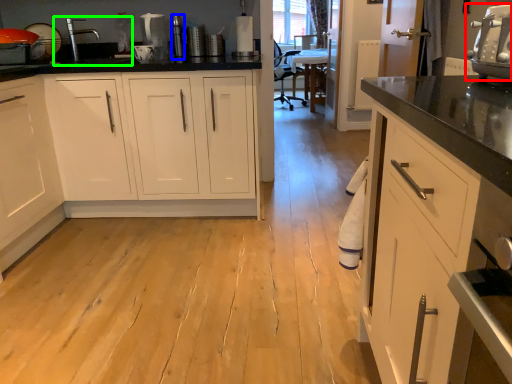
Question: Which object is positioned farthest from home appliance (highlighted by a red box)? Select from appliance (highlighted by a blue box) and sink (highlighted by a green box).

Choices:
 (A) appliance
 (B) sink

Answer: (B)